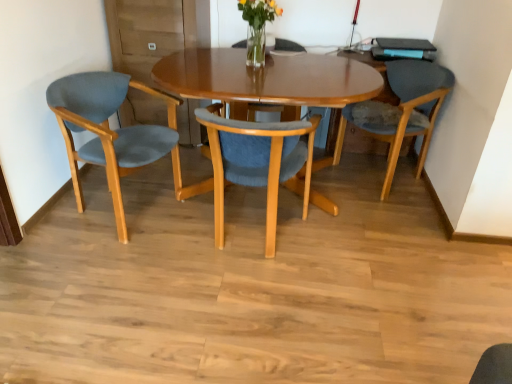
Find the location of `matte wood chair at center, acting as the 2th chair starting from the left`. matte wood chair at center, acting as the 2th chair starting from the left is located at coordinates (257, 161).

Measure the distance between matte wood chair at center, acting as the 2th chair starting from the left, and camera.

The depth of matte wood chair at center, acting as the 2th chair starting from the left, is 5.70 feet.

The height and width of the screenshot is (384, 512). What do you see at coordinates (110, 131) in the screenshot?
I see `matte blue fabric chair at left, the 1th chair in the left-to-right sequence` at bounding box center [110, 131].

At what (x,y) coordinates should I click in order to perform the action: click on matte blue cushioned chair at right, placed as the third chair when sorted from left to right. Please return your answer as a coordinate pair (x, y). Looking at the image, I should click on (411, 108).

Where is `matte wood chair at center, positioned as the 2th chair in right-to-left order`? matte wood chair at center, positioned as the 2th chair in right-to-left order is located at coordinates 257,161.

Between translucent glass vase at upper center and matte blue fabric chair at left, the 1th chair in the left-to-right sequence, which one has smaller size?

translucent glass vase at upper center is smaller.

Does translucent glass vase at upper center have a lesser height compared to matte blue fabric chair at left, the 1th chair in the left-to-right sequence?

Indeed, translucent glass vase at upper center has a lesser height compared to matte blue fabric chair at left, the 1th chair in the left-to-right sequence.

Between translucent glass vase at upper center and matte blue fabric chair at left, the 1th chair in the left-to-right sequence, which one has larger width?

matte blue fabric chair at left, the 1th chair in the left-to-right sequence.

Who is more distant, translucent glass vase at upper center or matte blue fabric chair at left, the 1th chair in the left-to-right sequence?

translucent glass vase at upper center is behind.

Between translucent glass vase at upper center and matte wood chair at center, positioned as the 2th chair in right-to-left order, which one is positioned in front?

matte wood chair at center, positioned as the 2th chair in right-to-left order, is closer to the camera.

Image resolution: width=512 pixels, height=384 pixels. I want to click on floral arrangement on the right of matte wood chair at center, positioned as the 2th chair in right-to-left order, so click(257, 27).

Does translucent glass vase at upper center have a greater width compared to matte wood chair at center, acting as the 2th chair starting from the left?

No, translucent glass vase at upper center is not wider than matte wood chair at center, acting as the 2th chair starting from the left.

Could you tell me if translucent glass vase at upper center is turned towards matte wood chair at center, acting as the 2th chair starting from the left?

No, translucent glass vase at upper center is not facing towards matte wood chair at center, acting as the 2th chair starting from the left.

Which is in front, point (262, 157) or point (411, 104)?

Positioned in front is point (262, 157).

How far apart are matte wood chair at center, positioned as the 2th chair in right-to-left order, and matte blue cushioned chair at right, the 1th chair viewed from the right?

matte wood chair at center, positioned as the 2th chair in right-to-left order, is 34.59 inches from matte blue cushioned chair at right, the 1th chair viewed from the right.

Does matte wood chair at center, positioned as the 2th chair in right-to-left order, appear on the left side of matte blue cushioned chair at right, placed as the third chair when sorted from left to right?

Indeed, matte wood chair at center, positioned as the 2th chair in right-to-left order, is positioned on the left side of matte blue cushioned chair at right, placed as the third chair when sorted from left to right.

There is a matte blue cushioned chair at right, placed as the third chair when sorted from left to right. Identify the location of the 2nd chair below it (from the image's perspective). (257, 161).

Consider the image. Can you tell me how much matte wood chair at center, positioned as the 2th chair in right-to-left order, and matte blue fabric chair at left, arranged as the 3th chair when viewed from the right, differ in facing direction?

99 degrees separate the facing orientations of matte wood chair at center, positioned as the 2th chair in right-to-left order, and matte blue fabric chair at left, arranged as the 3th chair when viewed from the right.

Based on the photo, from the image's perspective, which object appears higher, matte wood chair at center, positioned as the 2th chair in right-to-left order, or matte blue fabric chair at left, the 1th chair in the left-to-right sequence?

matte blue fabric chair at left, the 1th chair in the left-to-right sequence, appears higher in the image.

From the picture: From a real-world perspective, is matte wood chair at center, positioned as the 2th chair in right-to-left order, on matte blue fabric chair at left, the 1th chair in the left-to-right sequence?

Indeed, from a real-world perspective, matte wood chair at center, positioned as the 2th chair in right-to-left order, stands above matte blue fabric chair at left, the 1th chair in the left-to-right sequence.

Based on their sizes in the image, would you say matte wood chair at center, acting as the 2th chair starting from the left, is bigger or smaller than translucent glass vase at upper center?

Considering their sizes, matte wood chair at center, acting as the 2th chair starting from the left, takes up more space than translucent glass vase at upper center.

From the picture: From a real-world perspective, is matte wood chair at center, acting as the 2th chair starting from the left, positioned over translucent glass vase at upper center based on gravity?

No, from a real-world perspective, matte wood chair at center, acting as the 2th chair starting from the left, is not on top of translucent glass vase at upper center.

Who is taller, matte wood chair at center, positioned as the 2th chair in right-to-left order, or translucent glass vase at upper center?

With more height is matte wood chair at center, positioned as the 2th chair in right-to-left order.

Based on the photo, which object is positioned more to the right, matte wood chair at center, acting as the 2th chair starting from the left, or translucent glass vase at upper center?

Positioned to the right is translucent glass vase at upper center.

Is matte blue fabric chair at left, arranged as the 3th chair when viewed from the right, at the left side of matte wood chair at center, positioned as the 2th chair in right-to-left order?

Yes, matte blue fabric chair at left, arranged as the 3th chair when viewed from the right, is to the left of matte wood chair at center, positioned as the 2th chair in right-to-left order.

What's the angular difference between matte blue fabric chair at left, the 1th chair in the left-to-right sequence, and matte wood chair at center, acting as the 2th chair starting from the left,'s facing directions?

There is a 99-degree angle between the facing directions of matte blue fabric chair at left, the 1th chair in the left-to-right sequence, and matte wood chair at center, acting as the 2th chair starting from the left.

Is point (114, 100) positioned after point (279, 130)?

Yes, point (114, 100) is farther from viewer.

Does matte blue fabric chair at left, the 1th chair in the left-to-right sequence, turn towards matte wood chair at center, positioned as the 2th chair in right-to-left order?

Yes, matte blue fabric chair at left, the 1th chair in the left-to-right sequence, is aimed at matte wood chair at center, positioned as the 2th chair in right-to-left order.

Considering the sizes of objects matte blue fabric chair at left, arranged as the 3th chair when viewed from the right, and matte blue cushioned chair at right, the 1th chair viewed from the right, in the image provided, who is bigger, matte blue fabric chair at left, arranged as the 3th chair when viewed from the right, or matte blue cushioned chair at right, the 1th chair viewed from the right,?

Bigger between the two is matte blue cushioned chair at right, the 1th chair viewed from the right.

From the picture: Does matte blue fabric chair at left, the 1th chair in the left-to-right sequence, contain matte blue cushioned chair at right, the 1th chair viewed from the right?

No.

Which point is more forward, (79, 149) or (382, 139)?

The point (79, 149) is closer to the camera.

Who is more distant, matte blue fabric chair at left, the 1th chair in the left-to-right sequence, or matte blue cushioned chair at right, placed as the third chair when sorted from left to right?

matte blue cushioned chair at right, placed as the third chair when sorted from left to right.

What are the coordinates of `chair that is the 2nd object to the left of the translucent glass vase at upper center, starting at the anchor` in the screenshot? It's located at pyautogui.click(x=110, y=131).

In order to click on floral arrangement located above the matte wood chair at center, positioned as the 2th chair in right-to-left order (from the image's perspective) in this screenshot , I will do `click(257, 27)`.

When comparing their distances from matte wood chair at center, positioned as the 2th chair in right-to-left order, does matte blue fabric chair at left, the 1th chair in the left-to-right sequence, or matte blue cushioned chair at right, the 1th chair viewed from the right, seem closer?

Based on the image, matte blue fabric chair at left, the 1th chair in the left-to-right sequence, appears to be nearer to matte wood chair at center, positioned as the 2th chair in right-to-left order.

From the image, which object appears to be farther from matte blue fabric chair at left, the 1th chair in the left-to-right sequence, translucent glass vase at upper center or matte blue cushioned chair at right, the 1th chair viewed from the right?

Among the two, matte blue cushioned chair at right, the 1th chair viewed from the right, is located further to matte blue fabric chair at left, the 1th chair in the left-to-right sequence.

Which object lies further to the anchor point matte wood chair at center, acting as the 2th chair starting from the left, translucent glass vase at upper center or matte blue fabric chair at left, the 1th chair in the left-to-right sequence?

The object further to matte wood chair at center, acting as the 2th chair starting from the left, is translucent glass vase at upper center.

Consider the image. Based on their spatial positions, is matte blue cushioned chair at right, the 1th chair viewed from the right, or matte blue fabric chair at left, the 1th chair in the left-to-right sequence, further from translucent glass vase at upper center?

matte blue cushioned chair at right, the 1th chair viewed from the right, is positioned further to the anchor translucent glass vase at upper center.

Estimate the real-world distances between objects in this image. Which object is further from translucent glass vase at upper center, matte blue fabric chair at left, arranged as the 3th chair when viewed from the right, or matte wood chair at center, acting as the 2th chair starting from the left?

Among the two, matte blue fabric chair at left, arranged as the 3th chair when viewed from the right, is located further to translucent glass vase at upper center.

Based on their spatial positions, is matte wood chair at center, acting as the 2th chair starting from the left, or translucent glass vase at upper center closer to matte blue fabric chair at left, arranged as the 3th chair when viewed from the right?

Based on the image, matte wood chair at center, acting as the 2th chair starting from the left, appears to be nearer to matte blue fabric chair at left, arranged as the 3th chair when viewed from the right.

Estimate the real-world distances between objects in this image. Which object is closer to matte blue cushioned chair at right, placed as the third chair when sorted from left to right, matte wood chair at center, acting as the 2th chair starting from the left, or translucent glass vase at upper center?

Based on the image, matte wood chair at center, acting as the 2th chair starting from the left, appears to be nearer to matte blue cushioned chair at right, placed as the third chair when sorted from left to right.

Based on their spatial positions, is matte blue cushioned chair at right, the 1th chair viewed from the right, or translucent glass vase at upper center closer to matte blue fabric chair at left, the 1th chair in the left-to-right sequence?

The object closer to matte blue fabric chair at left, the 1th chair in the left-to-right sequence, is translucent glass vase at upper center.

Locate an element on the screen. The width and height of the screenshot is (512, 384). chair between matte blue fabric chair at left, arranged as the 3th chair when viewed from the right, and matte blue cushioned chair at right, placed as the third chair when sorted from left to right, from left to right is located at coordinates (257, 161).

Find the location of a particular element. floral arrangement between matte blue fabric chair at left, arranged as the 3th chair when viewed from the right, and matte blue cushioned chair at right, placed as the third chair when sorted from left to right, from left to right is located at coordinates pos(257,27).

Where is `floral arrangement situated between matte wood chair at center, acting as the 2th chair starting from the left, and matte blue cushioned chair at right, the 1th chair viewed from the right, from left to right`? floral arrangement situated between matte wood chair at center, acting as the 2th chair starting from the left, and matte blue cushioned chair at right, the 1th chair viewed from the right, from left to right is located at coordinates (257, 27).